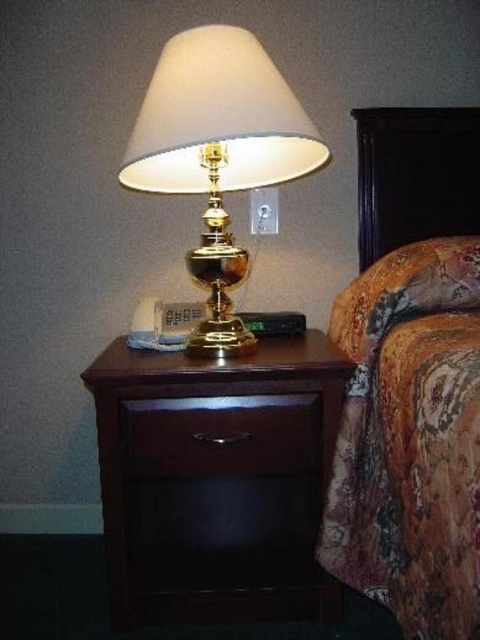
Question: Does floral fabric bed at right have a greater width compared to floral fabric pillow at right?

Choices:
 (A) yes
 (B) no

Answer: (A)

Question: Is gold polished table lamp at upper center bigger than floral fabric pillow at right?

Choices:
 (A) no
 (B) yes

Answer: (B)

Question: Can you confirm if dark wood dresser at center is positioned above gold polished table lamp at upper center?

Choices:
 (A) yes
 (B) no

Answer: (B)

Question: Which point is closer to the camera?

Choices:
 (A) (269, 419)
 (B) (429, 253)
 (C) (189, 83)

Answer: (C)

Question: Which point is farther to the camera?

Choices:
 (A) dark wood drawer at center
 (B) floral fabric bed at right

Answer: (A)

Question: Which point is farther to the camera?

Choices:
 (A) dark wood drawer at center
 (B) dark wood dresser at center
 (C) floral fabric pillow at right

Answer: (A)